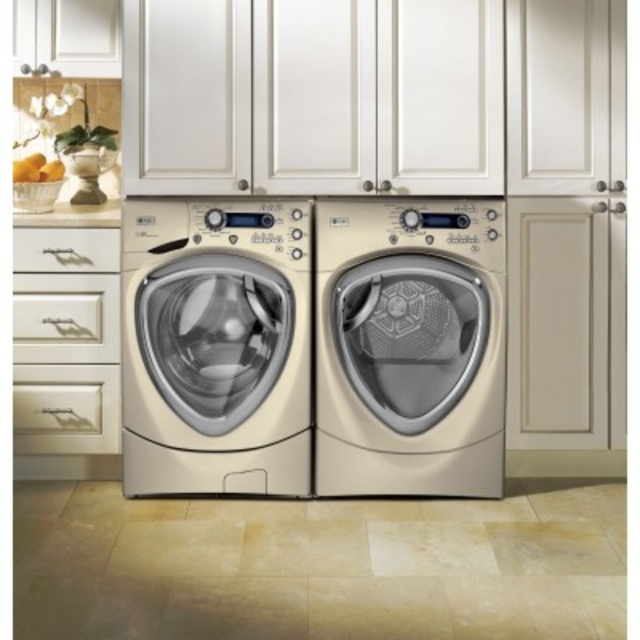
You are trying to place a 20 inch wide laundry basket between the two washing machines. Based on the image, will the basket fit between the matte beige washing machine at center and the cream matte washing machine at center?

The matte beige washing machine at center and cream matte washing machine at center are 20.27 inches apart from each other. Since the laundry basket is 20 inches wide, it will fit between them as there is enough space.

You are trying to decide which washing machine to use based on their height. The scene shows a matte beige washing machine at center and a cream matte washing machine at center. Which one is shorter?

The matte beige washing machine at center is shorter than the cream matte washing machine at center.

You are standing in the laundry room and want to use the cream matte washing machine at center. Which direction should you move to reach it first, considering the position of the matte beige washing machine at center?

The cream matte washing machine at center is behind the matte beige washing machine at center, so you should move backward past the matte beige washing machine at center to reach it.